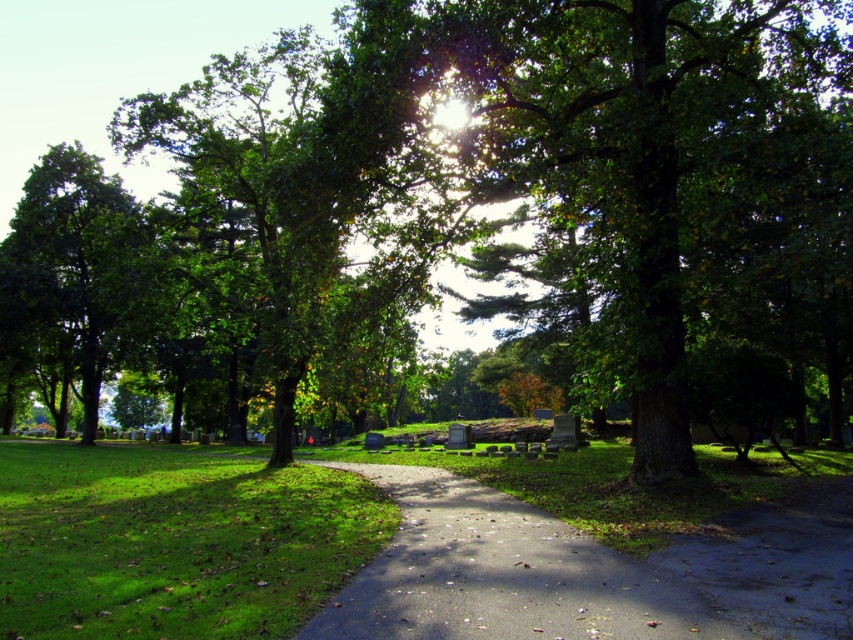
Question: Which point is farther from the camera taking this photo?

Choices:
 (A) (13, 272)
 (B) (386, 554)
 (C) (32, 467)

Answer: (A)

Question: Estimate the real-world distances between objects in this image. Which object is closer to the green grassy at center?

Choices:
 (A) green leafy tree at left
 (B) asphalt path at center

Answer: (B)

Question: Which point appears farthest from the camera in this image?

Choices:
 (A) pyautogui.click(x=100, y=596)
 (B) pyautogui.click(x=555, y=564)
 (C) pyautogui.click(x=38, y=260)

Answer: (C)

Question: Is asphalt path at center to the left of green leafy tree at left from the viewer's perspective?

Choices:
 (A) yes
 (B) no

Answer: (B)

Question: Is asphalt path at center to the left of green leafy tree at left from the viewer's perspective?

Choices:
 (A) yes
 (B) no

Answer: (B)

Question: Can you confirm if asphalt path at center is bigger than green leafy tree at left?

Choices:
 (A) no
 (B) yes

Answer: (A)